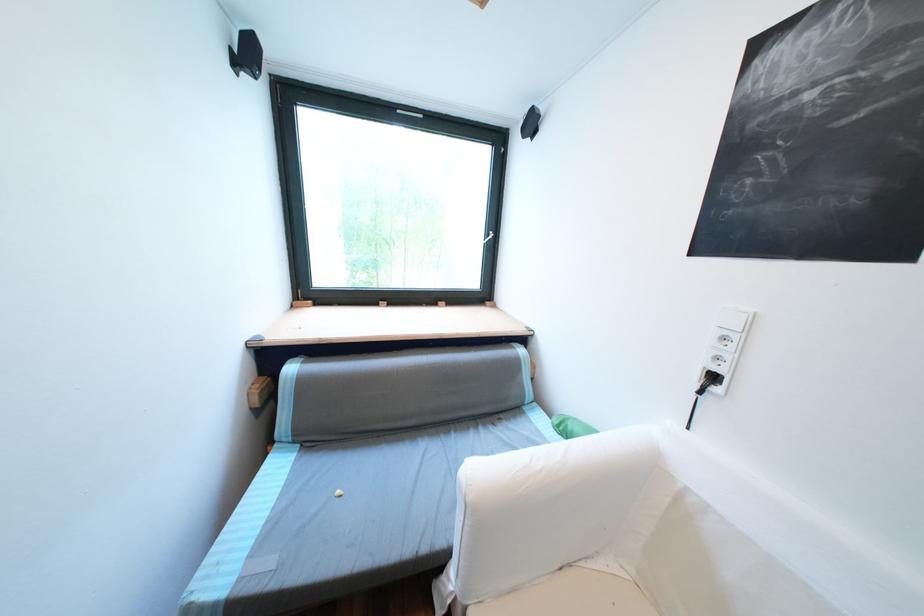
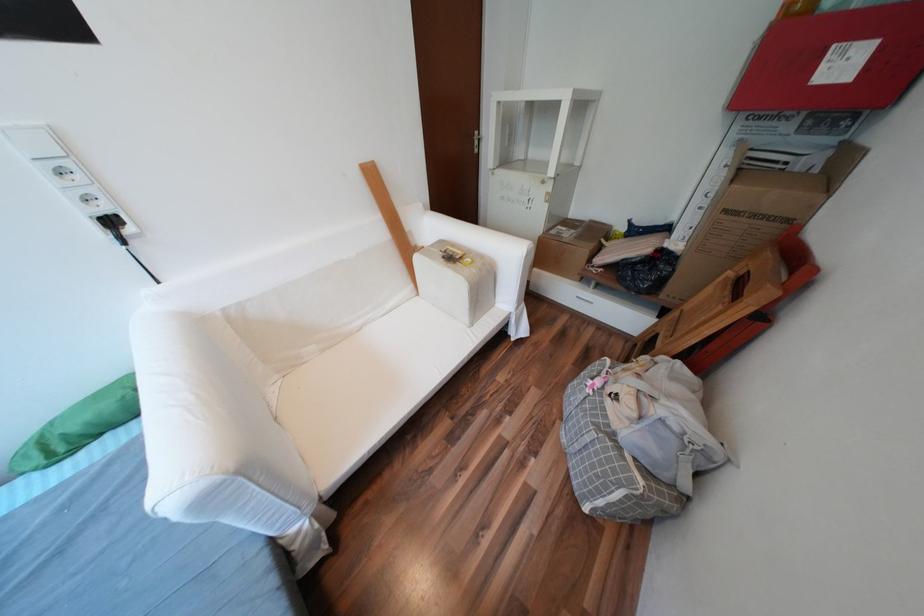
In the second image, find the point that corresponds to (725,390) in the first image.

(138, 231)